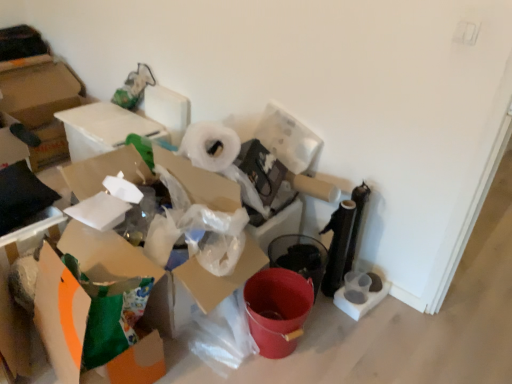
Locate an element on the screen. The image size is (512, 384). vacant space that is to the left of transparent plastic toilet paper at lower right is located at coordinates (325, 312).